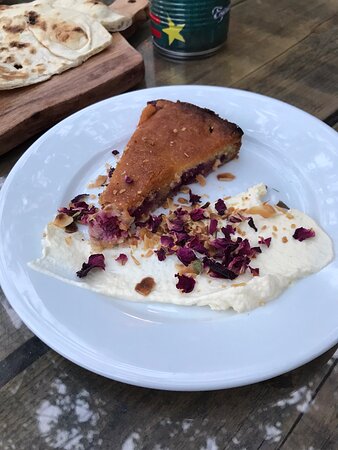
Identify the location of plate pie is on. The image size is (338, 450). (179, 358).